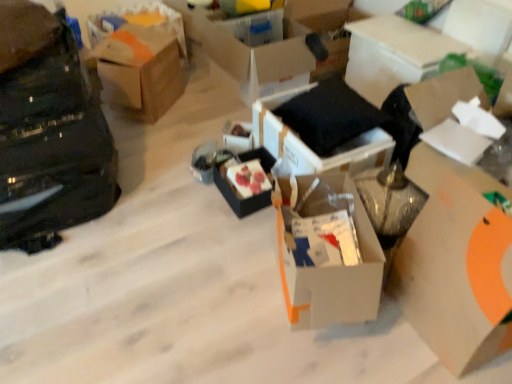
The height and width of the screenshot is (384, 512). Find the location of `free space to the left of white cardboard box at center, the second storage box from the right`. free space to the left of white cardboard box at center, the second storage box from the right is located at coordinates (200, 140).